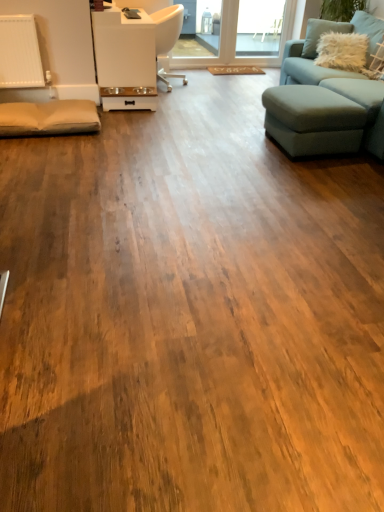
Question: From a real-world perspective, is white glossy pet feeder at upper center located beneath light blue fabric footrest at right?

Choices:
 (A) yes
 (B) no

Answer: (B)

Question: Does white glossy pet feeder at upper center appear on the right side of light blue fabric footrest at right?

Choices:
 (A) yes
 (B) no

Answer: (B)

Question: Are white glossy pet feeder at upper center and light blue fabric footrest at right located far from each other?

Choices:
 (A) no
 (B) yes

Answer: (B)

Question: Is white glossy pet feeder at upper center bigger than light blue fabric footrest at right?

Choices:
 (A) yes
 (B) no

Answer: (A)

Question: Can you confirm if white glossy pet feeder at upper center is thinner than light blue fabric footrest at right?

Choices:
 (A) no
 (B) yes

Answer: (B)

Question: Is white glossy pet feeder at upper center to the left of light blue fabric footrest at right from the viewer's perspective?

Choices:
 (A) yes
 (B) no

Answer: (A)

Question: Is white fluffy pillow at upper right further to camera compared to teal fabric studio couch at right?

Choices:
 (A) no
 (B) yes

Answer: (B)

Question: From the image's perspective, is white fluffy pillow at upper right beneath teal fabric studio couch at right?

Choices:
 (A) yes
 (B) no

Answer: (B)

Question: Are white fluffy pillow at upper right and teal fabric studio couch at right beside each other?

Choices:
 (A) no
 (B) yes

Answer: (A)

Question: Is white fluffy pillow at upper right bigger than teal fabric studio couch at right?

Choices:
 (A) yes
 (B) no

Answer: (B)

Question: Does white fluffy pillow at upper right appear on the right side of teal fabric studio couch at right?

Choices:
 (A) yes
 (B) no

Answer: (B)

Question: Does white fluffy pillow at upper right lie in front of teal fabric studio couch at right?

Choices:
 (A) no
 (B) yes

Answer: (A)

Question: Is white fluffy pillow at upper right facing towards white glossy pet feeder at upper center?

Choices:
 (A) yes
 (B) no

Answer: (B)